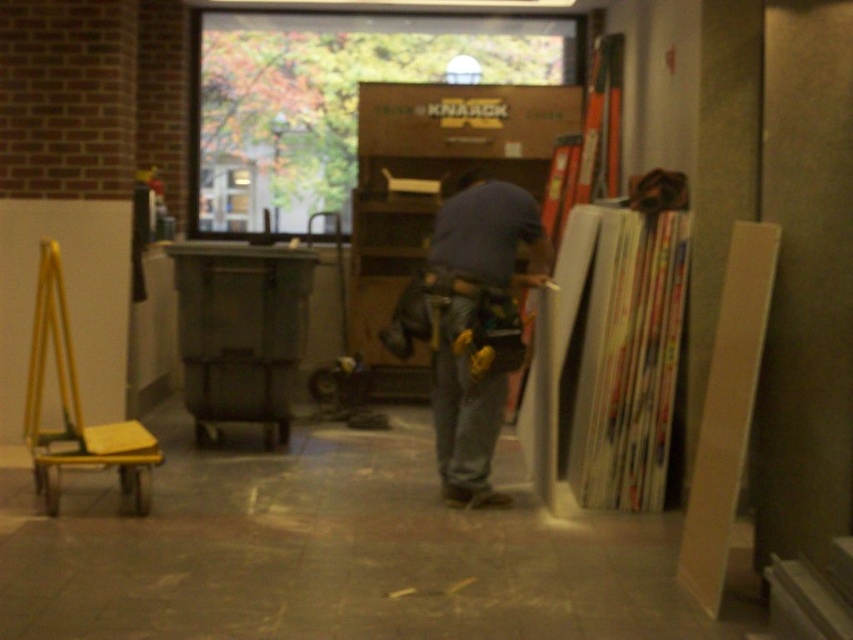
Is brown cardboard bookshelf at center closer to the viewer compared to blue denim jeans at center?

No, it is not.

Can you confirm if brown cardboard bookshelf at center is positioned below blue denim jeans at center?

No, brown cardboard bookshelf at center is not below blue denim jeans at center.

Is point (508, 88) positioned before point (488, 198)?

No, it is behind (488, 198).

The width and height of the screenshot is (853, 640). In order to click on brown cardboard bookshelf at center in this screenshot , I will do `click(432, 186)`.

In the scene shown: Is blue denim jeans at center bigger than denim at center?

Indeed, blue denim jeans at center has a larger size compared to denim at center.

Is blue denim jeans at center wider than denim at center?

Yes, blue denim jeans at center is wider than denim at center.

Is point (543, 284) positioned before point (488, 403)?

That is False.

At what (x,y) coordinates should I click in order to perform the action: click on blue denim jeans at center. Please return your answer as a coordinate pair (x, y). The width and height of the screenshot is (853, 640). Looking at the image, I should click on (477, 324).

Does point (428, 163) come behind point (462, 468)?

Yes, point (428, 163) is behind point (462, 468).

Can you confirm if brown cardboard bookshelf at center is positioned to the left of denim at center?

Correct, you'll find brown cardboard bookshelf at center to the left of denim at center.

Does point (537, 124) come in front of point (451, 448)?

No, it is behind (451, 448).

The height and width of the screenshot is (640, 853). Find the location of `brown cardboard bookshelf at center`. brown cardboard bookshelf at center is located at coordinates (432, 186).